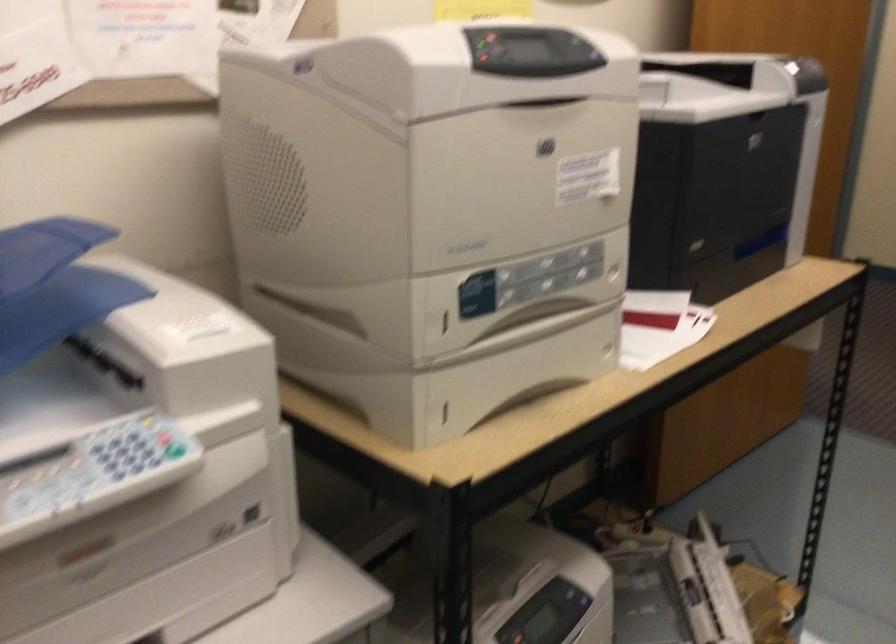
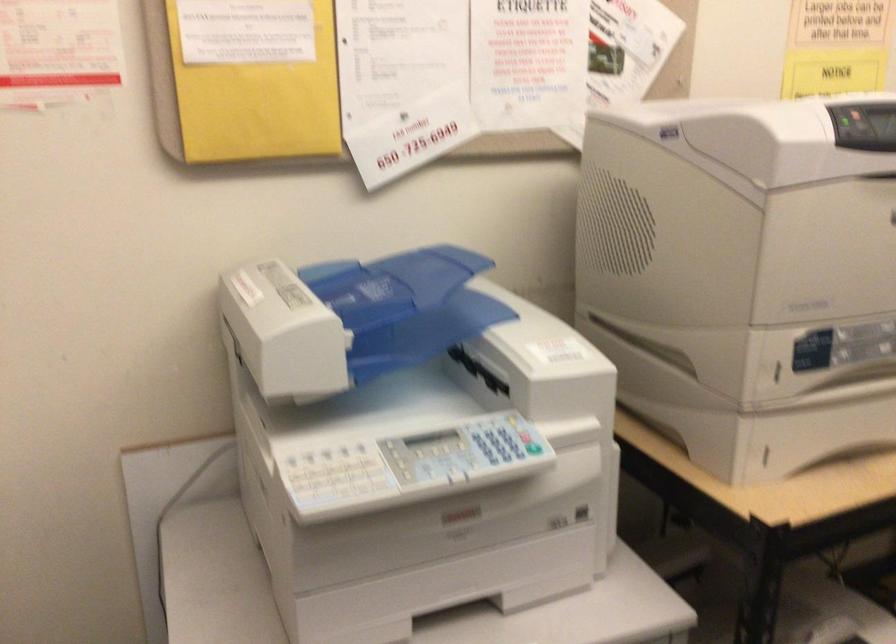
Find the pixel in the second image that matches (177,448) in the first image.

(533, 448)